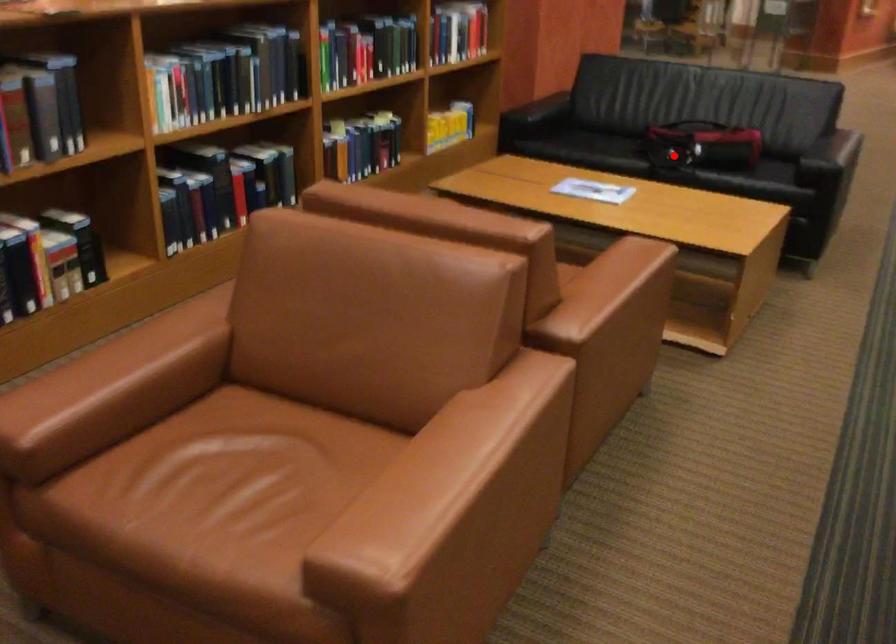
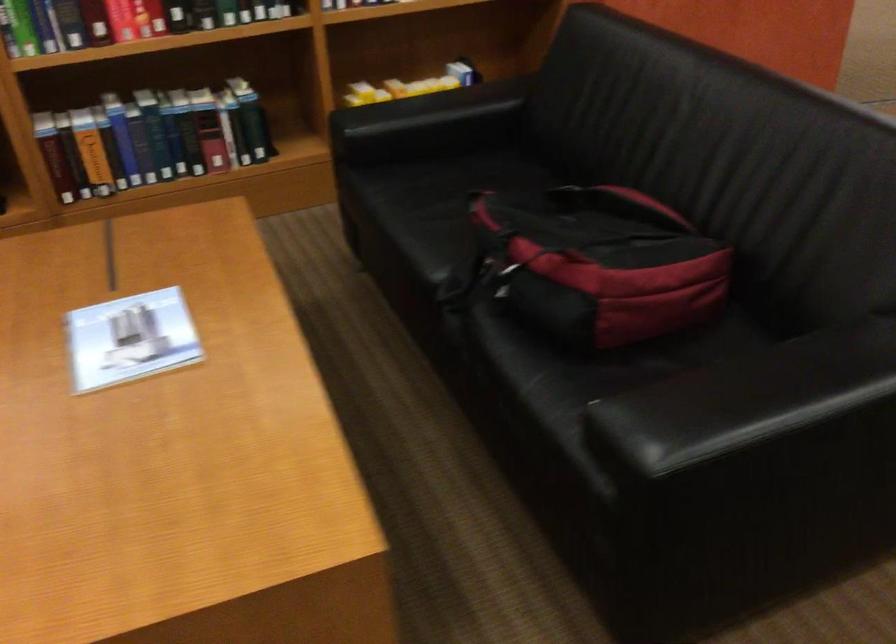
The point at the highlighted location is marked in the first image. Where is the corresponding point in the second image?

(495, 277)